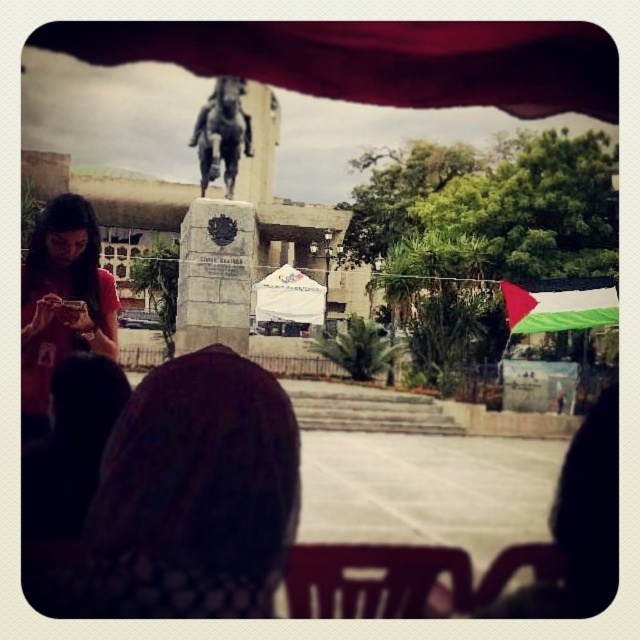
Question: Is matte red shirt at lower left bigger than bronze statue at center?

Choices:
 (A) yes
 (B) no

Answer: (A)

Question: Is matte red umbrella at upper center smaller than bronze statue at center?

Choices:
 (A) yes
 (B) no

Answer: (B)

Question: From the image, what is the correct spatial relationship of brown textured hair at center in relation to bronze statue at center?

Choices:
 (A) above
 (B) below

Answer: (B)

Question: Which point is closer to the camera?

Choices:
 (A) (552, 109)
 (B) (240, 122)

Answer: (B)

Question: Among these points, which one is nearest to the camera?

Choices:
 (A) (42, 218)
 (B) (296, 40)

Answer: (A)

Question: Which point appears closest to the camera in this image?

Choices:
 (A) (65, 259)
 (B) (116, 598)
 (C) (72, 35)
 (D) (221, 100)

Answer: (B)